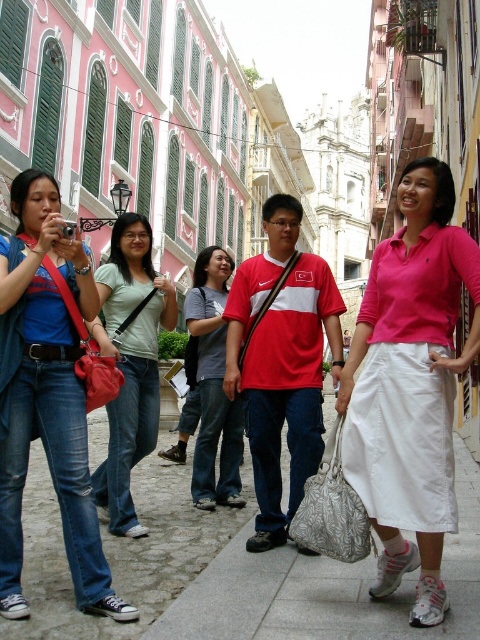
From the picture: You are a photographer trying to capture the group of tourists in the scene. You notice the light green cotton shirt at center and the matte red purse at left. Which object should you focus on first if you want to include both in your shot without moving the camera?

The matte red purse at left should be focused on first since the light green cotton shirt at center is positioned to its right, meaning the purse is closer to the left edge of the frame. By starting focus on the purse, you can ensure both objects remain in the shot without needing to reposition the camera.

You are a tour guide leading a group and need to ensure everyone stays within the designated walking path. The path is marked by the white tile pavement at lower center. Your group member wearing the pink cotton polo shirt at center is currently 6.06 meters away from the path. Is this distance within the safety zone of 5 meters required for group management?

The distance between the pink cotton polo shirt at center and the white tile pavement at lower center is 6.06 meters, which exceeds the 5 meters safety zone. Therefore, the group member is outside the required safety distance.